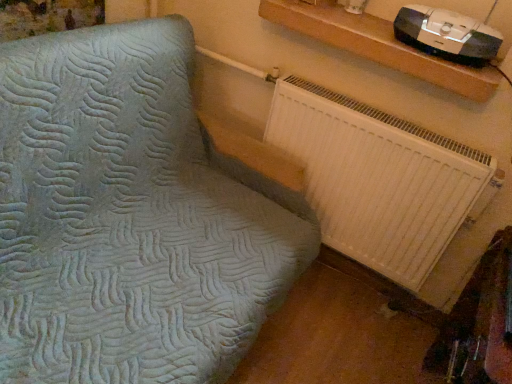
Question: Does black plastic stereo at upper right have a greater height compared to wooden shelf at upper right?

Choices:
 (A) yes
 (B) no

Answer: (A)

Question: Does black plastic stereo at upper right turn towards wooden shelf at upper right?

Choices:
 (A) yes
 (B) no

Answer: (B)

Question: Considering the relative sizes of black plastic stereo at upper right and wooden shelf at upper right in the image provided, is black plastic stereo at upper right wider than wooden shelf at upper right?

Choices:
 (A) yes
 (B) no

Answer: (B)

Question: Is black plastic stereo at upper right touching wooden shelf at upper right?

Choices:
 (A) no
 (B) yes

Answer: (A)

Question: Are black plastic stereo at upper right and wooden shelf at upper right far apart?

Choices:
 (A) yes
 (B) no

Answer: (B)

Question: From a real-world perspective, is black plastic stereo at upper right physically located above or below white plastic radiator at lower right?

Choices:
 (A) below
 (B) above

Answer: (B)

Question: Is point pyautogui.click(x=495, y=54) closer or farther from the camera than point pyautogui.click(x=473, y=205)?

Choices:
 (A) closer
 (B) farther

Answer: (A)

Question: Visually, is black plastic stereo at upper right positioned to the left or to the right of white plastic radiator at lower right?

Choices:
 (A) left
 (B) right

Answer: (B)

Question: In terms of width, does black plastic stereo at upper right look wider or thinner when compared to white plastic radiator at lower right?

Choices:
 (A) thin
 (B) wide

Answer: (B)

Question: Relative to wooden shelf at upper right, is white plastic radiator at lower right in front or behind?

Choices:
 (A) front
 (B) behind

Answer: (B)

Question: Considering the positions of point (330, 180) and point (436, 72), is point (330, 180) closer or farther from the camera than point (436, 72)?

Choices:
 (A) farther
 (B) closer

Answer: (A)

Question: Looking at their shapes, would you say white plastic radiator at lower right is wider or thinner than wooden shelf at upper right?

Choices:
 (A) thin
 (B) wide

Answer: (A)

Question: From the image's perspective, relative to wooden shelf at upper right, is white plastic radiator at lower right above or below?

Choices:
 (A) above
 (B) below

Answer: (B)

Question: In terms of width, does wooden shelf at upper right look wider or thinner when compared to black plastic stereo at upper right?

Choices:
 (A) thin
 (B) wide

Answer: (B)

Question: In terms of height, does wooden shelf at upper right look taller or shorter compared to black plastic stereo at upper right?

Choices:
 (A) tall
 (B) short

Answer: (B)